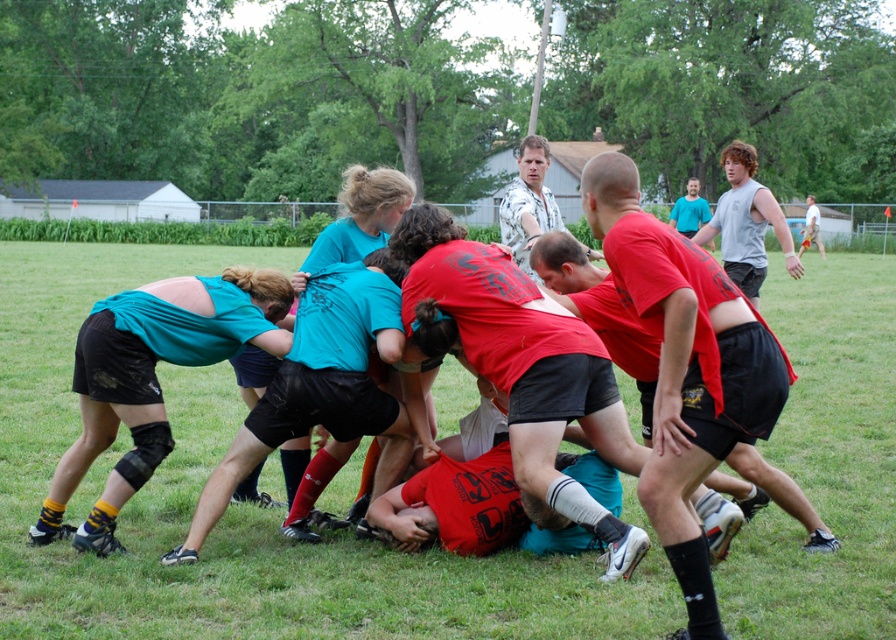
Which of these two, green grass at center or matte teal shirt at center, stands shorter?

matte teal shirt at center

Does green grass at center appear on the right side of matte teal shirt at center?

Yes, green grass at center is to the right of matte teal shirt at center.

Identify the location of green grass at center. (240, 506).